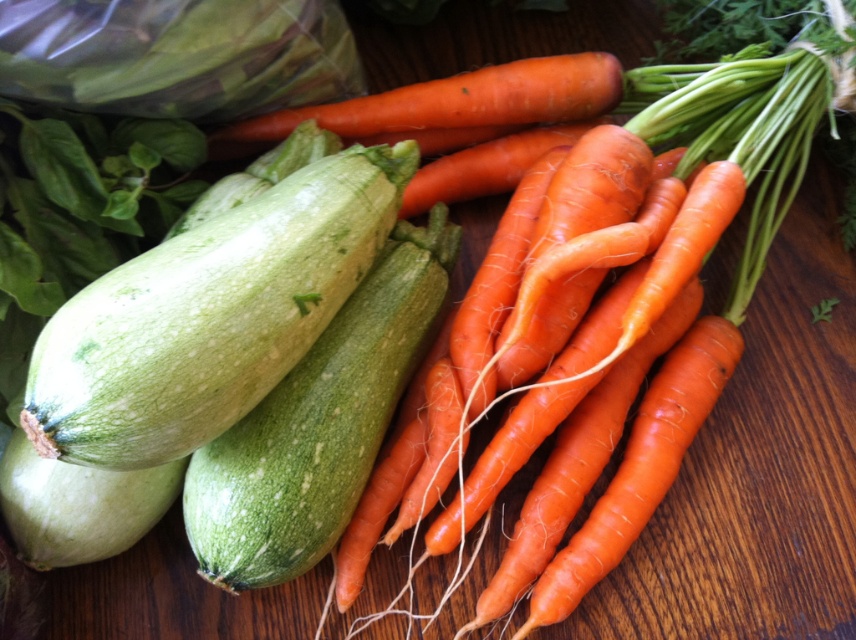
You are standing at the origin of a coordinate system where the wooden surface is the plane. You want to place a small sticker at point (209, 316). Which vegetable will the sticker land on?

The sticker will land on the green matte zucchini at left because the point (209, 316) corresponds to it according to the coordinates provided.

You are arranging vegetables on a small plate that can only hold one vegetable. You have the green matte zucchini at left and the orange smooth carrot at center. Which vegetable can you fit on the plate without overcrowding it?

The green matte zucchini at left occupies less space than the orange smooth carrot at center, so it can fit better on the small plate without overcrowding.